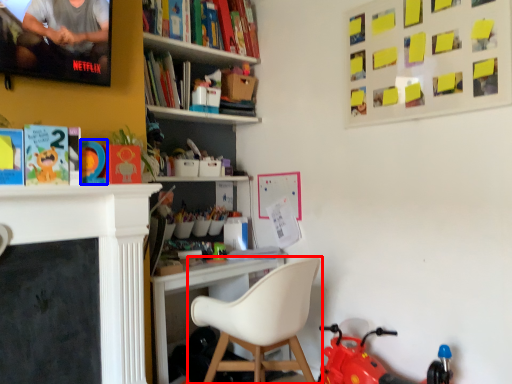
Question: Which object is closer to the camera taking this photo, chair (highlighted by a red box) or toy (highlighted by a blue box)?

Choices:
 (A) chair
 (B) toy

Answer: (A)